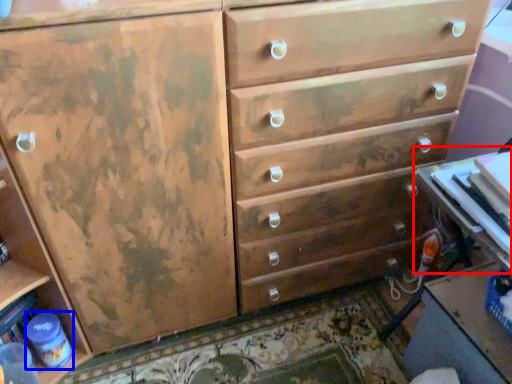
Question: Which of the following is the farthest to the observer, table (highlighted by a red box) or bottle (highlighted by a blue box)?

Choices:
 (A) table
 (B) bottle

Answer: (B)